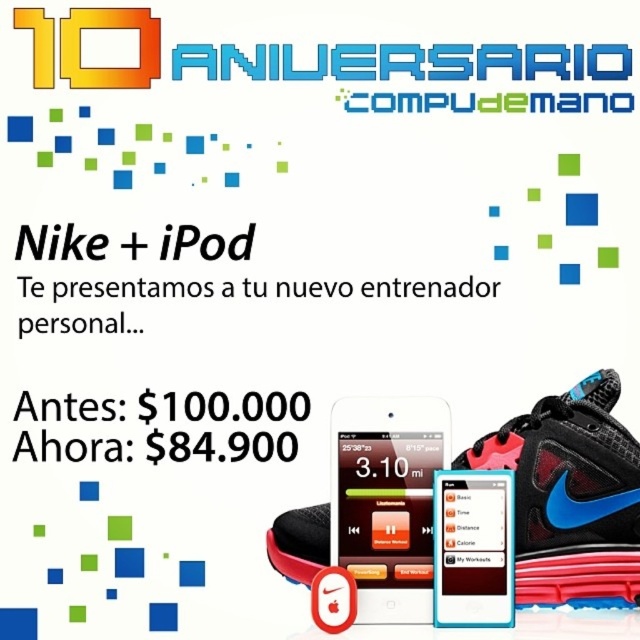
Question: Does black mesh shoe at lower right appear on the right side of satin black smartphone at center?

Choices:
 (A) no
 (B) yes

Answer: (B)

Question: Estimate the real-world distances between objects in this image. Which object is closer to the satin black smartphone at center?

Choices:
 (A) matte white smartphone at center
 (B) black mesh shoe at lower right

Answer: (A)

Question: Is black mesh shoe at lower right in front of satin black smartphone at center?

Choices:
 (A) no
 (B) yes

Answer: (A)

Question: Which object appears farthest from the camera in this image?

Choices:
 (A) black mesh shoe at lower right
 (B) matte white smartphone at center
 (C) satin black smartphone at center

Answer: (A)

Question: Is black mesh shoe at lower right to the right of matte white smartphone at center from the viewer's perspective?

Choices:
 (A) no
 (B) yes

Answer: (A)

Question: Which of the following is the farthest from the observer?

Choices:
 (A) (465, 602)
 (B) (406, 596)

Answer: (B)